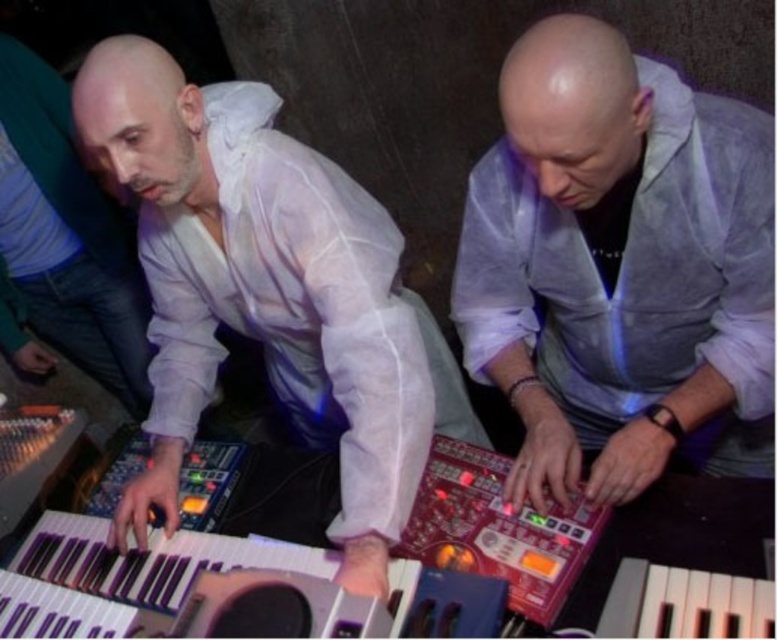
Question: Is white sheer shirt at center wider than metallic keyboard at lower left?

Choices:
 (A) no
 (B) yes

Answer: (B)

Question: Does translucent white shirt at center have a lesser width compared to white sheer shirt at center?

Choices:
 (A) yes
 (B) no

Answer: (A)

Question: Where is translucent white shirt at center located in relation to white sheer shirt at center in the image?

Choices:
 (A) above
 (B) below

Answer: (A)

Question: Which is farther from the metallic keyboard at lower left?

Choices:
 (A) translucent white shirt at center
 (B) white sheer shirt at center

Answer: (A)

Question: Which point is farther from the camera taking this photo?

Choices:
 (A) (258, 339)
 (B) (79, 618)

Answer: (A)

Question: Based on their relative distances, which object is farther from the white sheer shirt at center?

Choices:
 (A) translucent white shirt at center
 (B) metallic keyboard at lower left

Answer: (A)